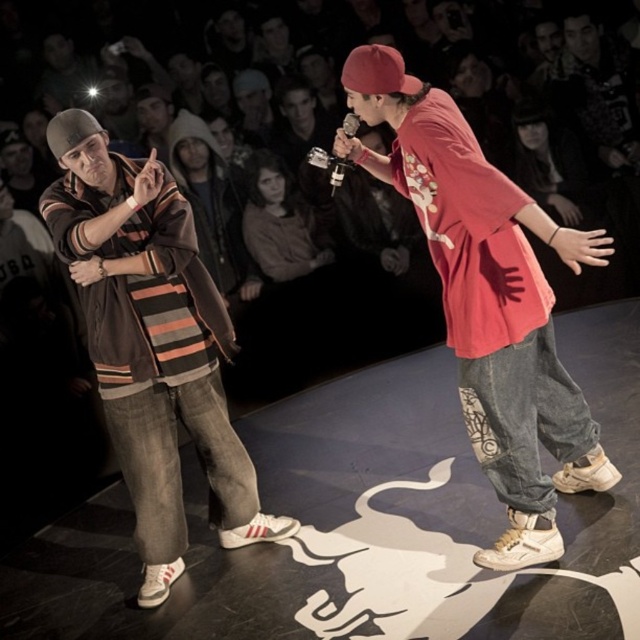
Looking at this image, does matte red shirt at center have a greater width compared to striped cotton shirt at left?

Correct, the width of matte red shirt at center exceeds that of striped cotton shirt at left.

Is point (518, 499) farther from camera compared to point (80, 252)?

No, it is in front of (80, 252).

At what (x,y) coordinates should I click in order to perform the action: click on matte red shirt at center. Please return your answer as a coordinate pair (x, y). This screenshot has height=640, width=640. Looking at the image, I should click on (493, 312).

Is striped cotton shirt at left closer to the viewer compared to red cotton baseball cap at upper center?

No, striped cotton shirt at left is behind red cotton baseball cap at upper center.

Measure the distance from striped cotton shirt at left to red cotton baseball cap at upper center.

striped cotton shirt at left and red cotton baseball cap at upper center are 4.63 feet apart.

Is point (168, 264) more distant than point (358, 88)?

Yes, point (168, 264) is behind point (358, 88).

You are a GUI agent. You are given a task and a screenshot of the screen. Output one action in this format:
    pyautogui.click(x=<x>, y=<y>)
    Task: Click on the striped cotton shirt at left
    The height and width of the screenshot is (640, 640).
    Given the screenshot: What is the action you would take?
    pyautogui.click(x=150, y=342)

Does matte red shirt at center appear under red cotton baseball cap at upper center?

Indeed, matte red shirt at center is positioned under red cotton baseball cap at upper center.

Between matte red shirt at center and red cotton baseball cap at upper center, which one has more height?

Standing taller between the two is matte red shirt at center.

From the picture: Who is more distant from viewer, (531,358) or (371,54)?

The point (531,358) is behind.

The height and width of the screenshot is (640, 640). Identify the location of matte red shirt at center. (493, 312).